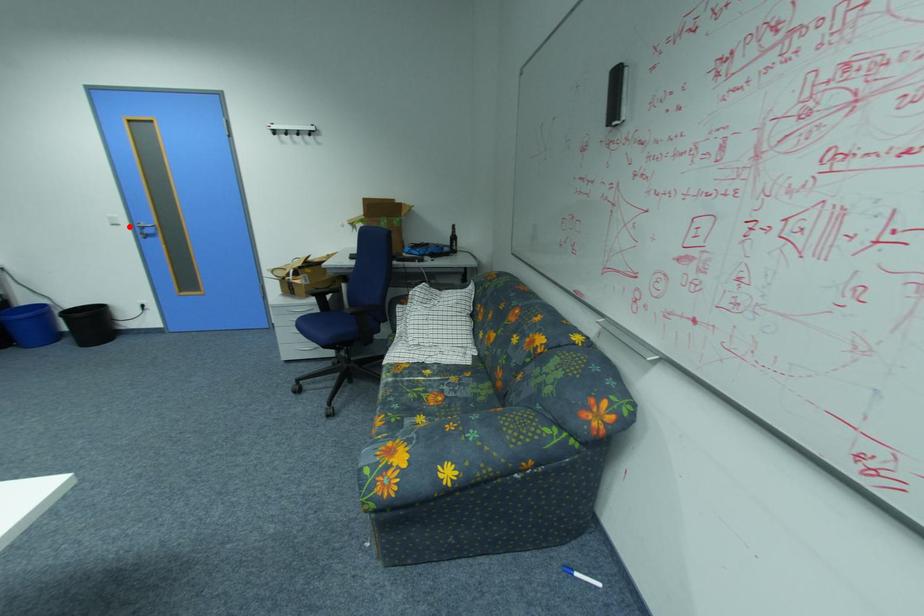
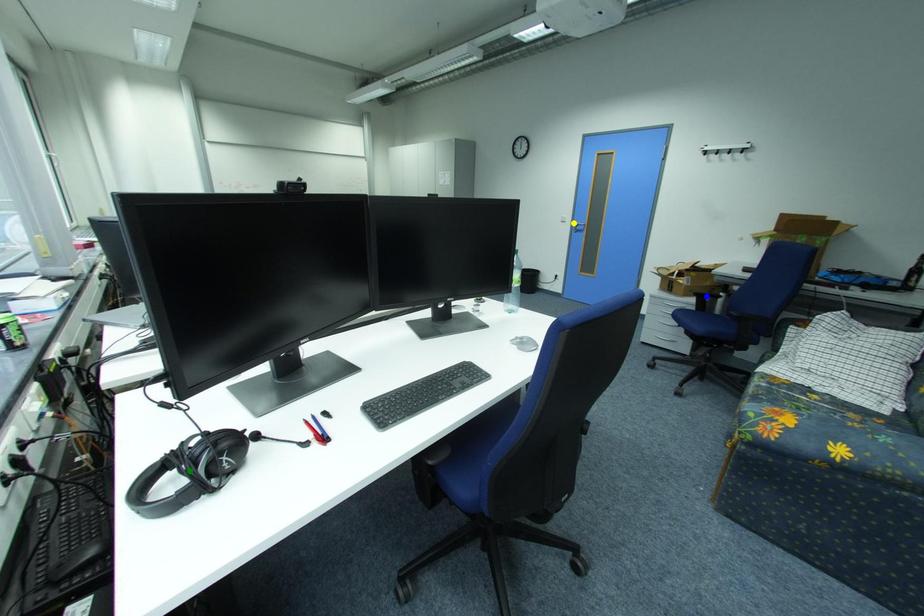
Question: I am providing you with two images of the same scene from different viewpoints. A red point is marked on the first image. You are given multiple points on the second image. Which point in image 2 represents the same 3d spot as the red point in image 1?

Choices:
 (A) yellow point
 (B) green point
 (C) blue point

Answer: (A)